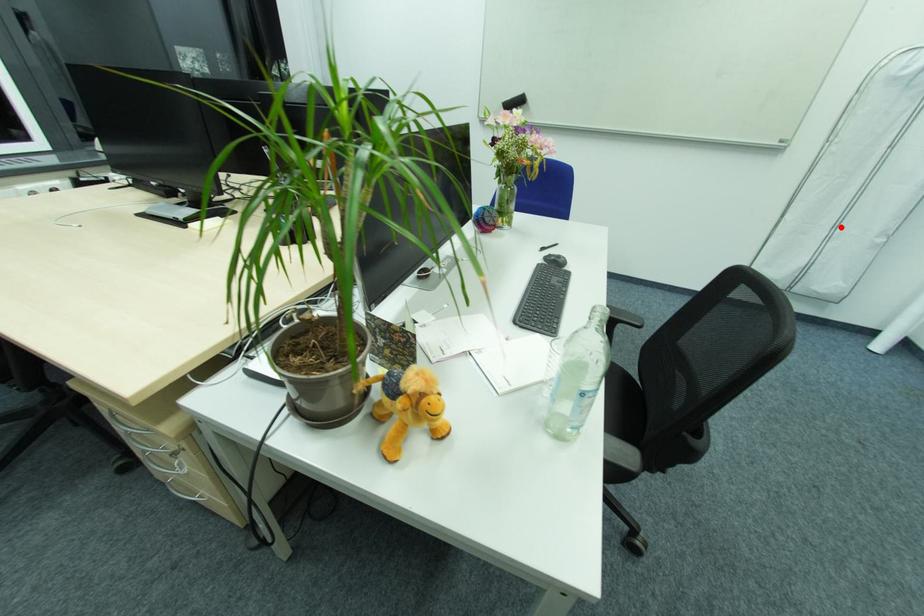
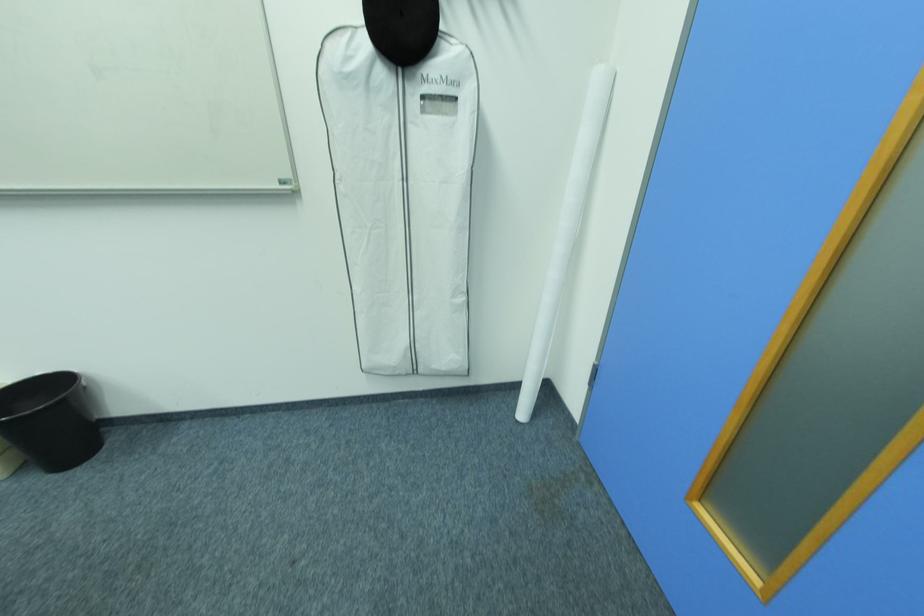
Where in the second image is the point corresponding to the highlighted location from the first image?

(416, 292)